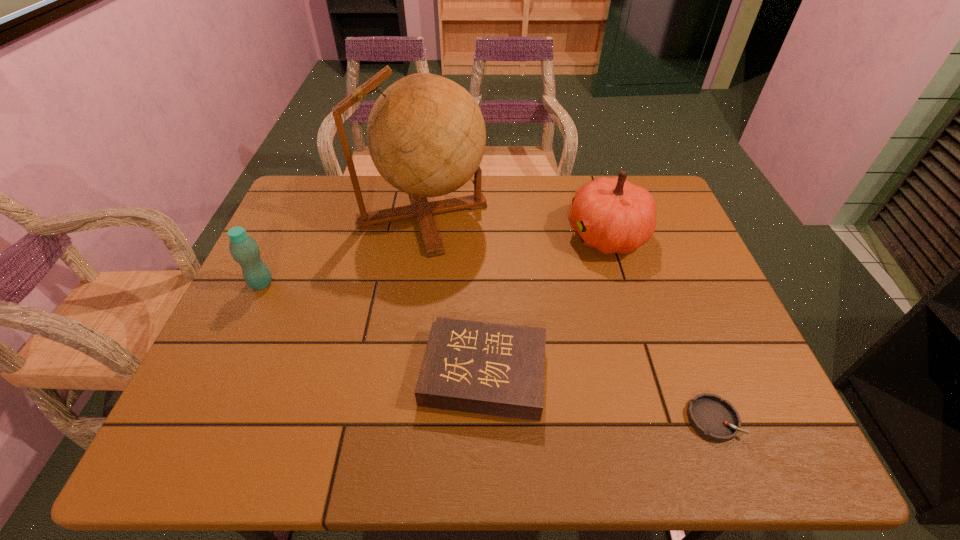
Find the location of `free point between the third shortest object and the hardback book`. free point between the third shortest object and the hardback book is located at coordinates (372, 328).

Find the location of `free space that is in between the tallest object and the third shortest object`. free space that is in between the tallest object and the third shortest object is located at coordinates pos(342,248).

You are a GUI agent. You are given a task and a screenshot of the screen. Output one action in this format:
    pyautogui.click(x=<x>, y=<y>)
    Task: Click on the empty location between the fourth tallest object and the tallest object
    This screenshot has width=960, height=540.
    Given the screenshot: What is the action you would take?
    pyautogui.click(x=453, y=293)

In order to click on vacant space that is in between the fourth tallest object and the ashtray in this screenshot , I will do `click(598, 396)`.

Find the location of a particular element. The image size is (960, 540). empty space between the fourth tallest object and the pumpkin is located at coordinates (545, 303).

The image size is (960, 540). Identify the location of free space between the ashtray and the globe. (567, 316).

At what (x,y) coordinates should I click in order to perform the action: click on unoccupied position between the second tallest object and the shortest object. Please return your answer as a coordinate pair (x, y). The height and width of the screenshot is (540, 960). Looking at the image, I should click on (660, 327).

You are a GUI agent. You are given a task and a screenshot of the screen. Output one action in this format:
    pyautogui.click(x=<x>, y=<y>)
    Task: Click on the object that is the second closest to the fourth tallest object
    Image resolution: width=960 pixels, height=540 pixels.
    Given the screenshot: What is the action you would take?
    pyautogui.click(x=426, y=135)

The image size is (960, 540). In order to click on object identified as the third closest to the ashtray in this screenshot , I will do `click(426, 135)`.

Identify the location of free space that satisfies the following two spatial constraints: 1. at the front cap of the third tallest object; 2. on the back side of the hardback book. (220, 373).